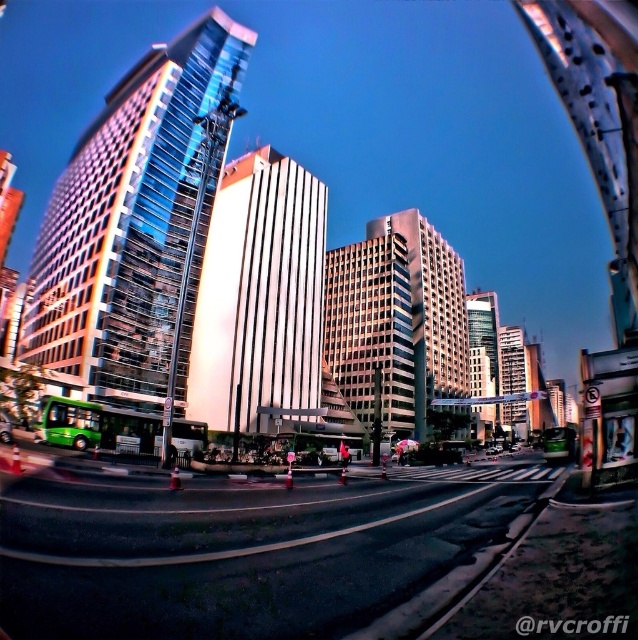
Question: Which is nearer to the black asphalt road at center?

Choices:
 (A) white glass building at center
 (B) white glossy building at center
 (C) glassy skyscraper at center

Answer: (B)

Question: Is black asphalt road at center positioned behind glassy skyscraper at center?

Choices:
 (A) no
 (B) yes

Answer: (A)

Question: Observing the image, what is the correct spatial positioning of glassy reflective skyscraper at center in reference to matte glass building at center?

Choices:
 (A) below
 (B) above

Answer: (B)

Question: Does glassy reflective skyscraper at center appear on the left side of matte glass building at center?

Choices:
 (A) yes
 (B) no

Answer: (A)

Question: Which of the following is the closest to the observer?

Choices:
 (A) glassy reflective skyscraper at center
 (B) glassy skyscraper at center

Answer: (A)

Question: Which point appears farthest from the camera in this image?

Choices:
 (A) (390, 310)
 (B) (420, 330)
 (C) (489, 339)

Answer: (C)